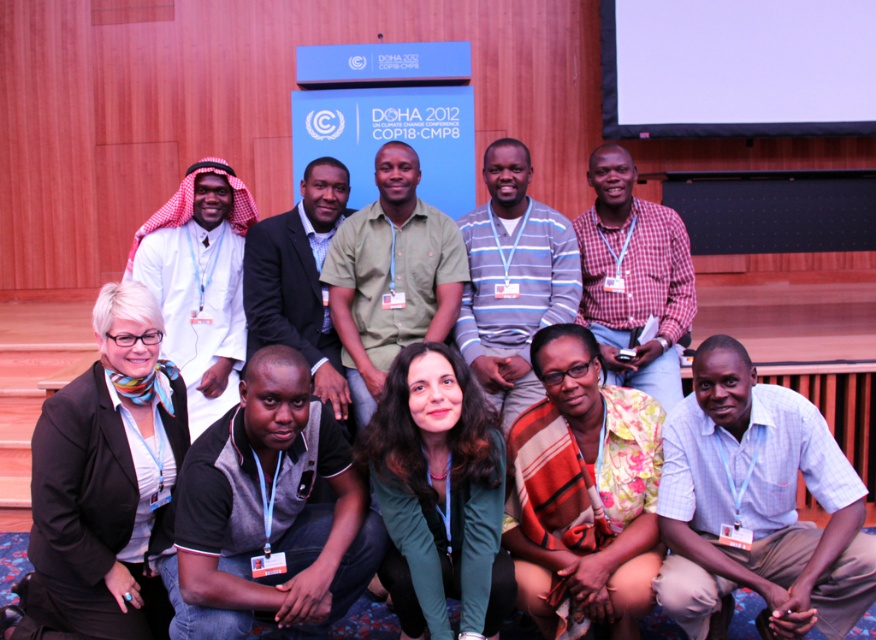
Question: Does black jersey at lower left have a lesser width compared to green cotton shirt at center?

Choices:
 (A) yes
 (B) no

Answer: (A)

Question: Does black jersey at lower left have a smaller size compared to green fabric jacket at center?

Choices:
 (A) no
 (B) yes

Answer: (A)

Question: Which is farther from the floral fabric shirt at lower center?

Choices:
 (A) white cotton kufi at upper left
 (B) black matte blazer at lower left

Answer: (A)

Question: Which of the following is the closest to the observer?

Choices:
 (A) white shirt at lower right
 (B) green fabric jacket at center
 (C) floral fabric shirt at lower center
 (D) plaid shirt at center

Answer: (A)

Question: Estimate the real-world distances between objects in this image. Which object is closer to the floral fabric shirt at lower center?

Choices:
 (A) green cotton shirt at center
 (B) black matte blazer at lower left
 (C) white shirt at lower right
 (D) plaid shirt at center

Answer: (C)

Question: Is white shirt at lower right closer to camera compared to black matte blazer at lower left?

Choices:
 (A) yes
 (B) no

Answer: (A)